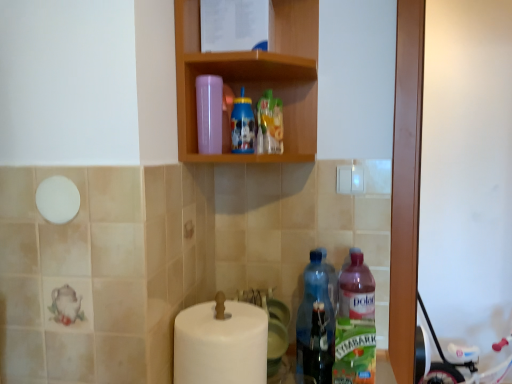
The height and width of the screenshot is (384, 512). What do you see at coordinates (221, 343) in the screenshot?
I see `white matte toilet paper at lower center` at bounding box center [221, 343].

Find the location of a particular element. The height and width of the screenshot is (384, 512). transparent plastic bottle at lower center, the 2th bottle when ordered from right to left is located at coordinates (315, 324).

Measure the distance between transparent plastic bottle at upper center, which ranks as the 1th bottle in left-to-right order, and camera.

The depth of transparent plastic bottle at upper center, which ranks as the 1th bottle in left-to-right order, is 37.41 inches.

Where is `white matte toilet paper at lower center`? Image resolution: width=512 pixels, height=384 pixels. white matte toilet paper at lower center is located at coordinates (221, 343).

Does transparent plastic bottle at upper center, the 4th bottle positioned from the right, have a larger size compared to white plastic baby carriage at lower right?

Incorrect, transparent plastic bottle at upper center, the 4th bottle positioned from the right, is not larger than white plastic baby carriage at lower right.

Is transparent plastic bottle at upper center, the 4th bottle positioned from the right, looking in the opposite direction of white plastic baby carriage at lower right?

No, transparent plastic bottle at upper center, the 4th bottle positioned from the right, is not facing away from white plastic baby carriage at lower right.

Is transparent plastic bottle at upper center, which ranks as the 1th bottle in left-to-right order, not close to white plastic baby carriage at lower right?

Yes, transparent plastic bottle at upper center, which ranks as the 1th bottle in left-to-right order, and white plastic baby carriage at lower right are quite far apart.

How many degrees apart are the facing directions of transparent plastic bottle at upper center, the 4th bottle positioned from the right, and white plastic baby carriage at lower right?

transparent plastic bottle at upper center, the 4th bottle positioned from the right, and white plastic baby carriage at lower right are facing 96.4 degrees away from each other.

What's the angular difference between wooden shelf at upper center and blue plastic bottle at upper center, marked as the 2th bottle in a left-to-right arrangement,'s facing directions?

1.88 degrees separate the facing orientations of wooden shelf at upper center and blue plastic bottle at upper center, marked as the 2th bottle in a left-to-right arrangement.

The image size is (512, 384). I want to click on shelf above the blue plastic bottle at upper center, which appears as the 3th bottle when viewed from the right (from a real-world perspective), so click(254, 78).

Which object is wider, wooden shelf at upper center or blue plastic bottle at upper center, marked as the 2th bottle in a left-to-right arrangement?

With larger width is wooden shelf at upper center.

Is the position of wooden shelf at upper center less distant than that of blue plastic bottle at upper center, which appears as the 3th bottle when viewed from the right?

Yes, wooden shelf at upper center is in front of blue plastic bottle at upper center, which appears as the 3th bottle when viewed from the right.

Considering the relative positions of polar translucent bottle at lower right, arranged as the fourth bottle when viewed from the left, and transparent plastic bottle at upper center, the 4th bottle positioned from the right, in the image provided, is polar translucent bottle at lower right, arranged as the fourth bottle when viewed from the left, to the right of transparent plastic bottle at upper center, the 4th bottle positioned from the right, from the viewer's perspective?

Correct, you'll find polar translucent bottle at lower right, arranged as the fourth bottle when viewed from the left, to the right of transparent plastic bottle at upper center, the 4th bottle positioned from the right.

How distant is polar translucent bottle at lower right, arranged as the fourth bottle when viewed from the left, from transparent plastic bottle at upper center, which ranks as the 1th bottle in left-to-right order?

20.76 inches.

Can you confirm if polar translucent bottle at lower right, which is counted as the 1th bottle, starting from the right, is wider than transparent plastic bottle at upper center, which ranks as the 1th bottle in left-to-right order?

Indeed, polar translucent bottle at lower right, which is counted as the 1th bottle, starting from the right, has a greater width compared to transparent plastic bottle at upper center, which ranks as the 1th bottle in left-to-right order.

From the image's perspective, is polar translucent bottle at lower right, arranged as the fourth bottle when viewed from the left, over transparent plastic bottle at upper center, which ranks as the 1th bottle in left-to-right order?

No, from the image's perspective, polar translucent bottle at lower right, arranged as the fourth bottle when viewed from the left, is not over transparent plastic bottle at upper center, which ranks as the 1th bottle in left-to-right order.

How different are the orientations of transparent plastic bottle at lower center, the 2th bottle when ordered from right to left, and white plastic baby carriage at lower right in degrees?

They differ by 5.06 degrees in their facing directions.

Could you measure the distance between transparent plastic bottle at lower center, the third bottle when ordered from left to right, and white plastic baby carriage at lower right?

5.57 feet.

Which is more to the left, transparent plastic bottle at lower center, the third bottle when ordered from left to right, or white plastic baby carriage at lower right?

transparent plastic bottle at lower center, the third bottle when ordered from left to right, is more to the left.

Is transparent plastic bottle at lower center, the 2th bottle when ordered from right to left, outside of white plastic baby carriage at lower right?

transparent plastic bottle at lower center, the 2th bottle when ordered from right to left, is positioned outside white plastic baby carriage at lower right.

From a real-world perspective, is blue plastic bottle at upper center, marked as the 2th bottle in a left-to-right arrangement, over wooden shelf at upper center?

No, from a real-world perspective, blue plastic bottle at upper center, marked as the 2th bottle in a left-to-right arrangement, is not above wooden shelf at upper center.

From the image's perspective, which object appears higher, blue plastic bottle at upper center, marked as the 2th bottle in a left-to-right arrangement, or wooden shelf at upper center?

From the image's view, wooden shelf at upper center is above.

Between blue plastic bottle at upper center, marked as the 2th bottle in a left-to-right arrangement, and wooden shelf at upper center, which one is positioned in front?

wooden shelf at upper center is closer to the camera.

Does point (249, 123) come farther from viewer compared to point (239, 79)?

That is False.

Locate an element on the screen. The width and height of the screenshot is (512, 384). baby carriage on the right of the transparent plastic bottle at lower center, the 2th bottle when ordered from right to left is located at coordinates (442, 362).

Which is behind, point (426, 377) or point (328, 321)?

Point (426, 377)

Consider the image. Between white plastic baby carriage at lower right and transparent plastic bottle at lower center, the 2th bottle when ordered from right to left, which one has less height?

transparent plastic bottle at lower center, the 2th bottle when ordered from right to left.

Is transparent plastic bottle at upper center, which ranks as the 1th bottle in left-to-right order, oriented away from wooden shelf at upper center?

Correct, transparent plastic bottle at upper center, which ranks as the 1th bottle in left-to-right order, is looking away from wooden shelf at upper center.

Considering the sizes of objects transparent plastic bottle at upper center, the 4th bottle positioned from the right, and wooden shelf at upper center in the image provided, who is thinner, transparent plastic bottle at upper center, the 4th bottle positioned from the right, or wooden shelf at upper center?

With smaller width is transparent plastic bottle at upper center, the 4th bottle positioned from the right.

Can you confirm if transparent plastic bottle at upper center, which ranks as the 1th bottle in left-to-right order, is bigger than wooden shelf at upper center?

No.

From their relative heights in the image, would you say transparent plastic bottle at upper center, the 4th bottle positioned from the right, is taller or shorter than wooden shelf at upper center?

Considering their sizes, transparent plastic bottle at upper center, the 4th bottle positioned from the right, has less height than wooden shelf at upper center.

The width and height of the screenshot is (512, 384). I want to click on the 3rd bottle located above the white plastic baby carriage at lower right (from a real-world perspective), so 209,113.

Starting from the wooden shelf at upper center, which bottle is the 1st one to the left? Please provide its 2D coordinates.

[(242, 125)]

Considering their positions, is wooden shelf at upper center positioned further to polar translucent bottle at lower right, arranged as the fourth bottle when viewed from the left, than transparent plastic bottle at lower center, the 2th bottle when ordered from right to left?

wooden shelf at upper center is further to polar translucent bottle at lower right, arranged as the fourth bottle when viewed from the left.

When comparing their distances from wooden shelf at upper center, does white plastic baby carriage at lower right or white matte toilet paper at lower center seem further?

white plastic baby carriage at lower right is further to wooden shelf at upper center.

From the image, which object appears to be nearer to blue plastic bottle at upper center, marked as the 2th bottle in a left-to-right arrangement, transparent plastic bottle at upper center, which ranks as the 1th bottle in left-to-right order, or white plastic baby carriage at lower right?

transparent plastic bottle at upper center, which ranks as the 1th bottle in left-to-right order, lies closer to blue plastic bottle at upper center, marked as the 2th bottle in a left-to-right arrangement, than the other object.

When comparing their distances from polar translucent bottle at lower right, arranged as the fourth bottle when viewed from the left, does white matte toilet paper at lower center or white plastic baby carriage at lower right seem closer?

white matte toilet paper at lower center is positioned closer to the anchor polar translucent bottle at lower right, arranged as the fourth bottle when viewed from the left.

Estimate the real-world distances between objects in this image. Which object is closer to blue plastic bottle at upper center, which appears as the 3th bottle when viewed from the right, wooden shelf at upper center or transparent plastic bottle at upper center, the 4th bottle positioned from the right?

Among the two, transparent plastic bottle at upper center, the 4th bottle positioned from the right, is located nearer to blue plastic bottle at upper center, which appears as the 3th bottle when viewed from the right.

From the image, which object appears to be farther from transparent plastic bottle at upper center, the 4th bottle positioned from the right, wooden shelf at upper center or white matte toilet paper at lower center?

white matte toilet paper at lower center lies further to transparent plastic bottle at upper center, the 4th bottle positioned from the right, than the other object.

When comparing their distances from polar translucent bottle at lower right, arranged as the fourth bottle when viewed from the left, does white plastic baby carriage at lower right or transparent plastic bottle at upper center, which ranks as the 1th bottle in left-to-right order, seem closer?

Among the two, transparent plastic bottle at upper center, which ranks as the 1th bottle in left-to-right order, is located nearer to polar translucent bottle at lower right, arranged as the fourth bottle when viewed from the left.

Based on their spatial positions, is transparent plastic bottle at upper center, the 4th bottle positioned from the right, or polar translucent bottle at lower right, arranged as the fourth bottle when viewed from the left, further from wooden shelf at upper center?

polar translucent bottle at lower right, arranged as the fourth bottle when viewed from the left, is further to wooden shelf at upper center.

Find the location of a particular element. This screenshot has height=384, width=512. bottle between transparent plastic bottle at upper center, which ranks as the 1th bottle in left-to-right order, and polar translucent bottle at lower right, arranged as the fourth bottle when viewed from the left, in the vertical direction is located at coordinates coord(315,324).

Where is `toilet paper between transparent plastic bottle at upper center, the 4th bottle positioned from the right, and white plastic baby carriage at lower right from left to right`? toilet paper between transparent plastic bottle at upper center, the 4th bottle positioned from the right, and white plastic baby carriage at lower right from left to right is located at coordinates (221, 343).

Identify the location of shelf between white matte toilet paper at lower center and white plastic baby carriage at lower right. Image resolution: width=512 pixels, height=384 pixels. (254, 78).

The width and height of the screenshot is (512, 384). I want to click on bottle between blue plastic bottle at upper center, which appears as the 3th bottle when viewed from the right, and transparent plastic bottle at lower center, the 2th bottle when ordered from right to left, vertically, so click(209, 113).